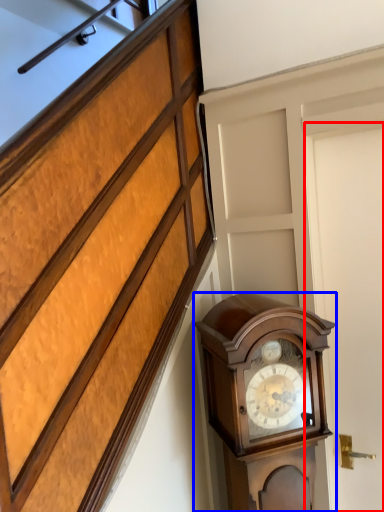
Question: Which object appears closest to the camera in this image, door (highlighted by a red box) or wall clock (highlighted by a blue box)?

Choices:
 (A) door
 (B) wall clock

Answer: (B)